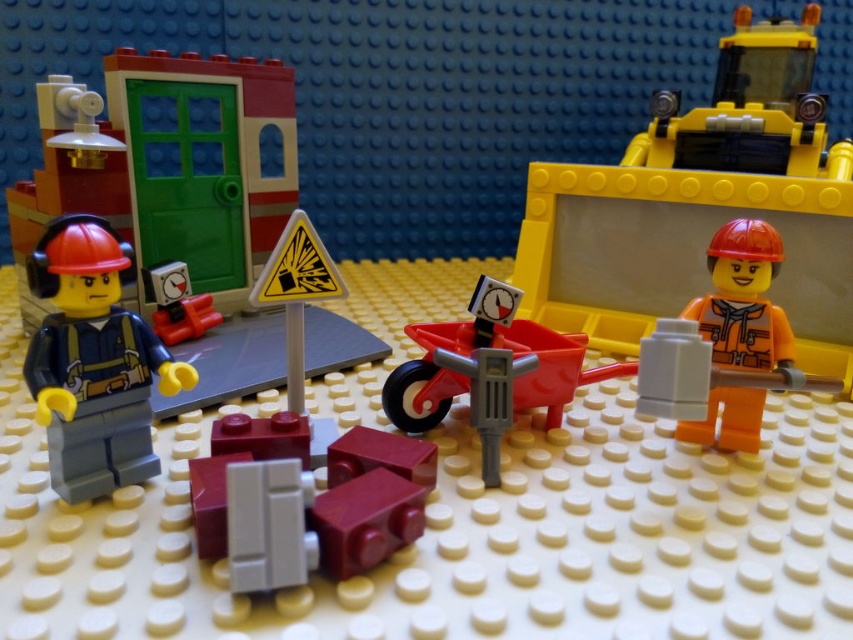
Who is positioned more to the right, orange matte construction worker at right or matte red clock at left?

orange matte construction worker at right

Does point (717, 364) lie behind point (189, 328)?

No.

Where is `orange matte construction worker at right`? The image size is (853, 640). orange matte construction worker at right is located at coordinates (740, 333).

Is matte black construction worker at left shorter than smooth red wheelbarrow at center?

In fact, matte black construction worker at left may be taller than smooth red wheelbarrow at center.

Does matte black construction worker at left appear under smooth red wheelbarrow at center?

Actually, matte black construction worker at left is above smooth red wheelbarrow at center.

Identify the location of matte black construction worker at left. (93, 362).

Locate an element on the screen. This screenshot has height=640, width=853. matte black construction worker at left is located at coordinates (93, 362).

Does smooth red wheelbarrow at center appear under matte red clock at left?

Yes, smooth red wheelbarrow at center is below matte red clock at left.

Between point (610, 376) and point (165, 282), which one is positioned behind?

The point (165, 282) is more distant.

Who is more distant from viewer, (471, 362) or (207, 310)?

Positioned behind is point (207, 310).

Locate an element on the screen. The width and height of the screenshot is (853, 640). smooth red wheelbarrow at center is located at coordinates (489, 371).